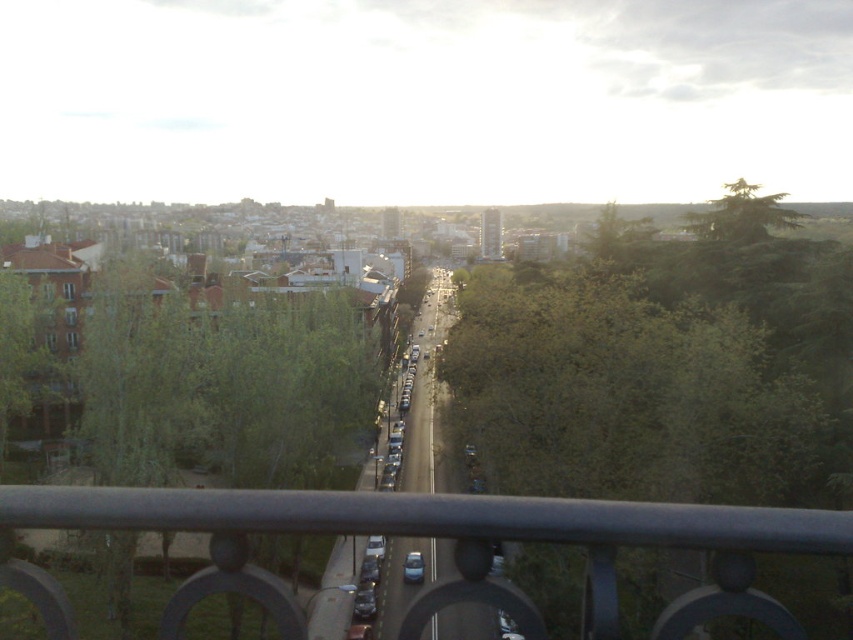
Can you confirm if green leafy tree at center is wider than satin black car at center?

Yes, green leafy tree at center is wider than satin black car at center.

Is point (498, 328) positioned after point (421, 579)?

No, (498, 328) is in front of (421, 579).

You are a GUI agent. You are given a task and a screenshot of the screen. Output one action in this format:
    pyautogui.click(x=<x>, y=<y>)
    Task: Click on the green leafy tree at center
    This screenshot has height=640, width=853.
    Given the screenshot: What is the action you would take?
    pyautogui.click(x=660, y=371)

Consider the image. Measure the distance between green leafy tree at upper right and satin black car at center.

The distance of green leafy tree at upper right from satin black car at center is 35.70 meters.

Is green leafy tree at upper right bigger than satin black car at center?

Correct, green leafy tree at upper right is larger in size than satin black car at center.

Does point (699, 237) come in front of point (413, 556)?

No.

Where is `green leafy tree at upper right`? This screenshot has width=853, height=640. green leafy tree at upper right is located at coordinates (741, 214).

Is metallic gray railing at center above satin black car at center?

Indeed, metallic gray railing at center is positioned over satin black car at center.

Does metallic gray railing at center have a lesser height compared to satin black car at center?

No, metallic gray railing at center is not shorter than satin black car at center.

Is point (770, 518) closer to camera compared to point (422, 560)?

Yes, point (770, 518) is in front of point (422, 560).

Find the location of a particular element. The height and width of the screenshot is (640, 853). metallic gray railing at center is located at coordinates (445, 525).